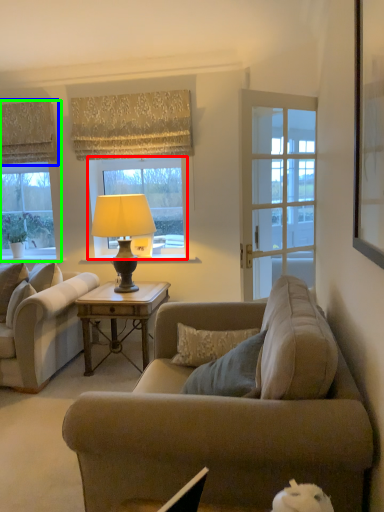
Question: Based on their relative distances, which object is farther from window (highlighted by a red box)? Choose from curtain (highlighted by a blue box) and window (highlighted by a green box).

Choices:
 (A) curtain
 (B) window

Answer: (B)